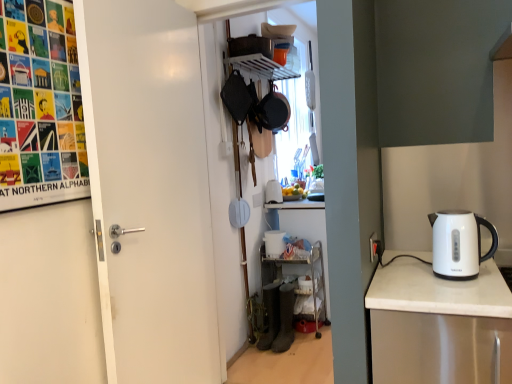
What is the approximate width of white plastic bucket at lower center, which is counted as the second appliance, starting from the back?

The width of white plastic bucket at lower center, which is counted as the second appliance, starting from the back, is 6.89 inches.

This screenshot has width=512, height=384. Describe the element at coordinates (274, 243) in the screenshot. I see `white plastic bucket at lower center, acting as the 2th appliance starting from the front` at that location.

Describe the element at coordinates (273, 111) in the screenshot. I see `matte black frying pan at upper center` at that location.

Describe the element at coordinates (262, 66) in the screenshot. The image size is (512, 384). I see `white plastic shelf at upper center, the 1th shelf from the top` at that location.

The height and width of the screenshot is (384, 512). In order to click on white plastic shelf at upper center, the 1th shelf from the top in this screenshot , I will do `click(262, 66)`.

Measure the distance between white glossy electric kettle at right and camera.

A distance of 3.71 feet exists between white glossy electric kettle at right and camera.

Identify the location of white plastic bucket at lower center, marked as the 2th appliance in a top-to-bottom arrangement. The width and height of the screenshot is (512, 384). (274, 243).

From their relative heights in the image, would you say white glossy electric kettle at right is taller or shorter than white matte door at left?

white glossy electric kettle at right is shorter than white matte door at left.

Considering the positions of points (424, 271) and (93, 206), is point (424, 271) farther from camera compared to point (93, 206)?

Yes, point (424, 271) is behind point (93, 206).

From the image's perspective, does white glossy electric kettle at right appear lower than white matte door at left?

Correct, white glossy electric kettle at right appears lower than white matte door at left in the image.

From the image's perspective, is white plastic bucket at lower center, which is counted as the second appliance, starting from the back, located above or below matte black kettle at lower center, placed as the 1th appliance when sorted from front to back?

Based on their image positions, white plastic bucket at lower center, which is counted as the second appliance, starting from the back, is located above matte black kettle at lower center, placed as the 1th appliance when sorted from front to back.

In terms of size, does white plastic bucket at lower center, which is counted as the second appliance, starting from the back, appear bigger or smaller than matte black kettle at lower center, the 1th appliance when ordered from bottom to top?

Considering their sizes, white plastic bucket at lower center, which is counted as the second appliance, starting from the back, takes up less space than matte black kettle at lower center, the 1th appliance when ordered from bottom to top.

What's the angular difference between white plastic bucket at lower center, which is counted as the second appliance, starting from the back, and matte black kettle at lower center, placed as the 1th appliance when sorted from front to back,'s facing directions?

The angle between the facing direction of white plastic bucket at lower center, which is counted as the second appliance, starting from the back, and the facing direction of matte black kettle at lower center, placed as the 1th appliance when sorted from front to back, is 0.000536 degrees.

Is white plastic bucket at lower center, acting as the 2th appliance starting from the front, closer to camera compared to matte black kettle at lower center, placed as the 1th appliance when sorted from front to back?

No, it is not.

From a real-world perspective, is matte black kettle at lower center, placed as the 1th appliance when sorted from front to back, above or below matte black frying pan at upper center?

In terms of real-world spatial position, matte black kettle at lower center, placed as the 1th appliance when sorted from front to back, is below matte black frying pan at upper center.

Considering the sizes of objects matte black kettle at lower center, which is the third appliance from top to bottom, and matte black frying pan at upper center in the image provided, who is bigger, matte black kettle at lower center, which is the third appliance from top to bottom, or matte black frying pan at upper center?

matte black frying pan at upper center is bigger.

How far apart are matte black kettle at lower center, the 1th appliance when ordered from bottom to top, and matte black frying pan at upper center?

The distance of matte black kettle at lower center, the 1th appliance when ordered from bottom to top, from matte black frying pan at upper center is 4.14 feet.

Can you confirm if matte black kettle at lower center, the 1th appliance when ordered from bottom to top, is thinner than matte black frying pan at upper center?

No, matte black kettle at lower center, the 1th appliance when ordered from bottom to top, is not thinner than matte black frying pan at upper center.

Is the depth of multicolored paper poster at upper left greater than that of white matte door at left?

No, multicolored paper poster at upper left is closer to the viewer.

Is point (33, 2) farther from camera compared to point (101, 276)?

That is False.

Where is `door lying below the multicolored paper poster at upper left (from the image's perspective)`? Image resolution: width=512 pixels, height=384 pixels. door lying below the multicolored paper poster at upper left (from the image's perspective) is located at coordinates (149, 190).

Consider the image. Who is taller, multicolored paper poster at upper left or white matte door at left?

With more height is white matte door at left.

Which of these two, metallic silver shelf at lower center, which is counted as the 2th shelf, starting from the top, or white glossy electric kettle at right, is wider?

metallic silver shelf at lower center, which is counted as the 2th shelf, starting from the top.

Is metallic silver shelf at lower center, which is counted as the 2th shelf, starting from the top, turned away from white glossy electric kettle at right?

metallic silver shelf at lower center, which is counted as the 2th shelf, starting from the top, is not turned away from white glossy electric kettle at right.

From a real-world perspective, is metallic silver shelf at lower center, the first shelf when ordered from bottom to top, physically above white glossy electric kettle at right?

No, from a real-world perspective, metallic silver shelf at lower center, the first shelf when ordered from bottom to top, is not over white glossy electric kettle at right

Looking at this image, could you tell me if white glossy electric kettle at right is facing multicolored paper poster at upper left?

No, white glossy electric kettle at right is not turned towards multicolored paper poster at upper left.

Considering the sizes of white glossy electric kettle at right and multicolored paper poster at upper left in the image, is white glossy electric kettle at right wider or thinner than multicolored paper poster at upper left?

In the image, white glossy electric kettle at right appears to be wider than multicolored paper poster at upper left.

Locate an element on the screen. Image resolution: width=512 pixels, height=384 pixels. poster above the white glossy electric kettle at right (from a real-world perspective) is located at coordinates (40, 106).

In the image, is white glossy electric kettle at right on the left side or the right side of multicolored paper poster at upper left?

white glossy electric kettle at right is positioned on multicolored paper poster at upper left's right side.

Does white matte door at left have a greater width compared to white glossy electric kettle at right?

In fact, white matte door at left might be narrower than white glossy electric kettle at right.

Where is `kettle on the right of white matte door at left`? The height and width of the screenshot is (384, 512). kettle on the right of white matte door at left is located at coordinates (459, 244).

Is the surface of white matte door at left in direct contact with white glossy electric kettle at right?

They are not placed beside each other.

At what (x,y) coordinates should I click in order to perform the action: click on cabinetry that is in front of the white matte door at left. Please return your answer as a coordinate pair (x, y). The width and height of the screenshot is (512, 384). Looking at the image, I should click on [438, 325].

At what (x,y) coordinates should I click in order to perform the action: click on the 1st appliance positioned above the matte black kettle at lower center, placed as the 1th appliance when sorted from front to back (from a real-world perspective). Please return your answer as a coordinate pair (x, y). The height and width of the screenshot is (384, 512). Looking at the image, I should click on [274, 243].

Considering their positions, is white matte door at left positioned further to white glossy electric kettle at right than multicolored paper poster at upper left?

multicolored paper poster at upper left.

From the image, which object appears to be farther from matte black kettle at lower center, the 1th appliance when ordered from bottom to top, white glossy electric kettle at right or white glossy toaster at center, positioned as the third appliance in bottom-to-top order?

Result: white glossy electric kettle at right.

Based on the photo, based on their spatial positions, is metallic silver shelf at lower center, which is counted as the 2th shelf, starting from the top, or white plastic shelf at upper center, marked as the second shelf in a bottom-to-top arrangement, further from white glossy electric kettle at right?

white plastic shelf at upper center, marked as the second shelf in a bottom-to-top arrangement, is positioned further to the anchor white glossy electric kettle at right.

From the picture: Which object lies further to the anchor point matte black frying pan at upper center, white glossy electric kettle at right or metallic silver shelf at lower center, which is counted as the 2th shelf, starting from the top?

Among the two, white glossy electric kettle at right is located further to matte black frying pan at upper center.

Which object lies further to the anchor point metallic silver shelf at lower center, which is counted as the 2th shelf, starting from the top, matte black frying pan at upper center or matte black kettle at lower center, the 3th appliance in the back-to-front sequence?

matte black frying pan at upper center lies further to metallic silver shelf at lower center, which is counted as the 2th shelf, starting from the top, than the other object.

Based on their spatial positions, is matte black frying pan at upper center or matte black kettle at lower center, the 3th appliance in the back-to-front sequence, closer to white glossy electric kettle at right?

matte black kettle at lower center, the 3th appliance in the back-to-front sequence, lies closer to white glossy electric kettle at right than the other object.

Estimate the real-world distances between objects in this image. Which object is closer to white plastic bucket at lower center, acting as the 2th appliance starting from the front, matte black kettle at lower center, which is the third appliance from top to bottom, or white matte door at left?

matte black kettle at lower center, which is the third appliance from top to bottom, is closer to white plastic bucket at lower center, acting as the 2th appliance starting from the front.

From the image, which object appears to be nearer to white plastic shelf at upper center, the 1th shelf from the top, matte black kettle at lower center, the 3th appliance in the back-to-front sequence, or white glossy toaster at center, the first appliance when ordered from back to front?

white glossy toaster at center, the first appliance when ordered from back to front, is closer to white plastic shelf at upper center, the 1th shelf from the top.

The image size is (512, 384). Find the location of `appliance between multicolored paper poster at upper left and metallic silver shelf at lower center, the first shelf when ordered from bottom to top, along the z-axis`. appliance between multicolored paper poster at upper left and metallic silver shelf at lower center, the first shelf when ordered from bottom to top, along the z-axis is located at coordinates (285, 319).

Identify the location of poster between white plastic shelf at upper center, the 1th shelf from the top, and matte black kettle at lower center, placed as the 1th appliance when sorted from front to back, in the vertical direction. This screenshot has width=512, height=384. (40, 106).

Find the location of a particular element. The image size is (512, 384). door positioned between white glossy electric kettle at right and matte black frying pan at upper center from near to far is located at coordinates (149, 190).

Where is `poster located between white glossy electric kettle at right and white plastic bucket at lower center, the 2th appliance positioned from the bottom, in the depth direction`? The width and height of the screenshot is (512, 384). poster located between white glossy electric kettle at right and white plastic bucket at lower center, the 2th appliance positioned from the bottom, in the depth direction is located at coordinates (40, 106).